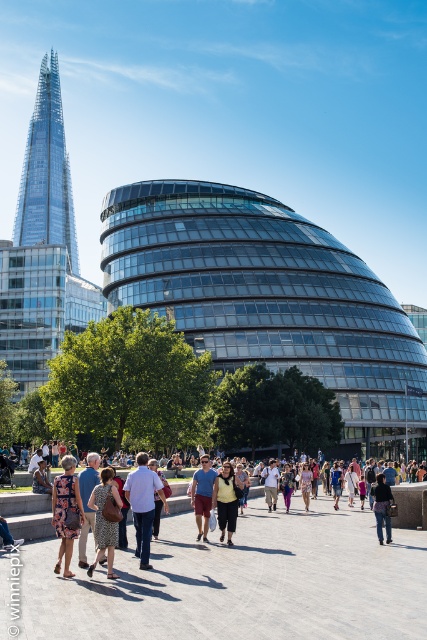
Question: Estimate the real-world distances between objects in this image. Which object is farther from the matte black backpack at center?

Choices:
 (A) patterned fabric dress at center
 (B) denim shorts at center
 (C) matte blue shorts at center
 (D) transparent glass tower at upper left

Answer: (D)

Question: Among these points, which one is farthest from the camera?

Choices:
 (A) (365, 452)
 (B) (49, 481)
 (C) (233, 504)
 (D) (333, 468)

Answer: (A)

Question: Does matte blue shorts at center have a smaller size compared to matte black backpack at center?

Choices:
 (A) yes
 (B) no

Answer: (B)

Question: Estimate the real-world distances between objects in this image. Which object is farther from the transparent glass tower at upper left?

Choices:
 (A) transparent glass building at center
 (B) blue denim jeans at center
 (C) matte black backpack at center
 (D) patterned fabric dress at center

Answer: (C)

Question: Is transparent glass tower at upper left below matte black backpack at center?

Choices:
 (A) yes
 (B) no

Answer: (B)

Question: Is yellow matte vest at center positioned at the back of blue denim jeans at center?

Choices:
 (A) yes
 (B) no

Answer: (B)